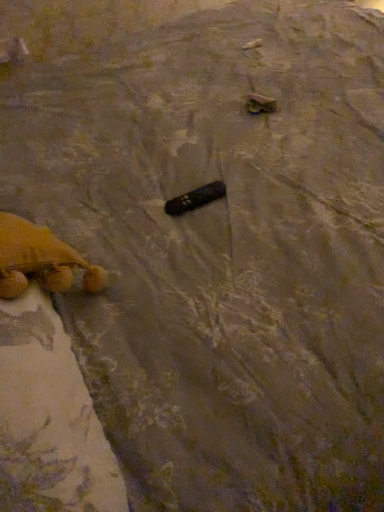
Measure the distance between point (216, 181) and camera.

They are 92.00 centimeters apart.

The width and height of the screenshot is (384, 512). I want to click on black plastic remote at center, so click(x=195, y=198).

Describe the element at coordinates (195, 198) in the screenshot. Image resolution: width=384 pixels, height=512 pixels. I see `black plastic remote at center` at that location.

Where is `black plastic remote at center`? The height and width of the screenshot is (512, 384). black plastic remote at center is located at coordinates (195, 198).